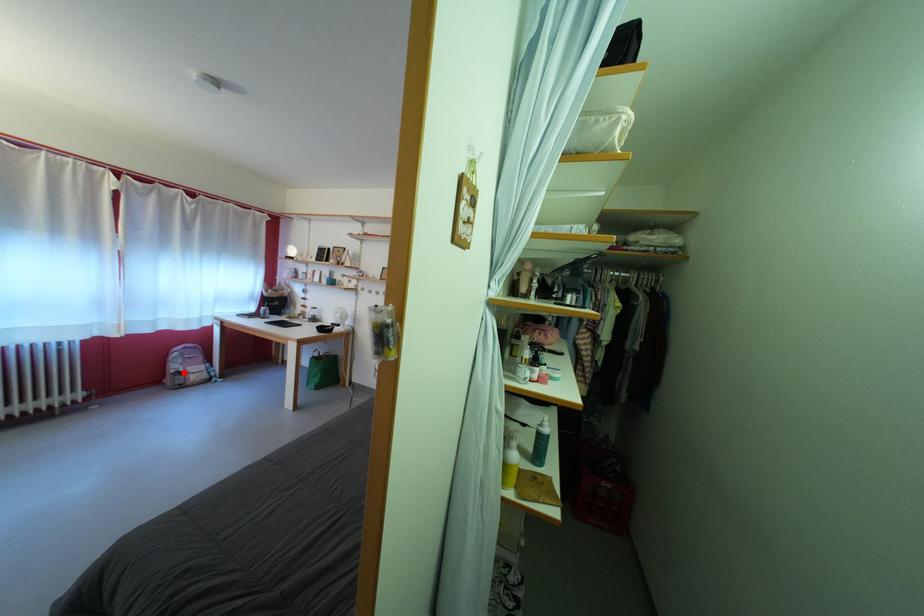
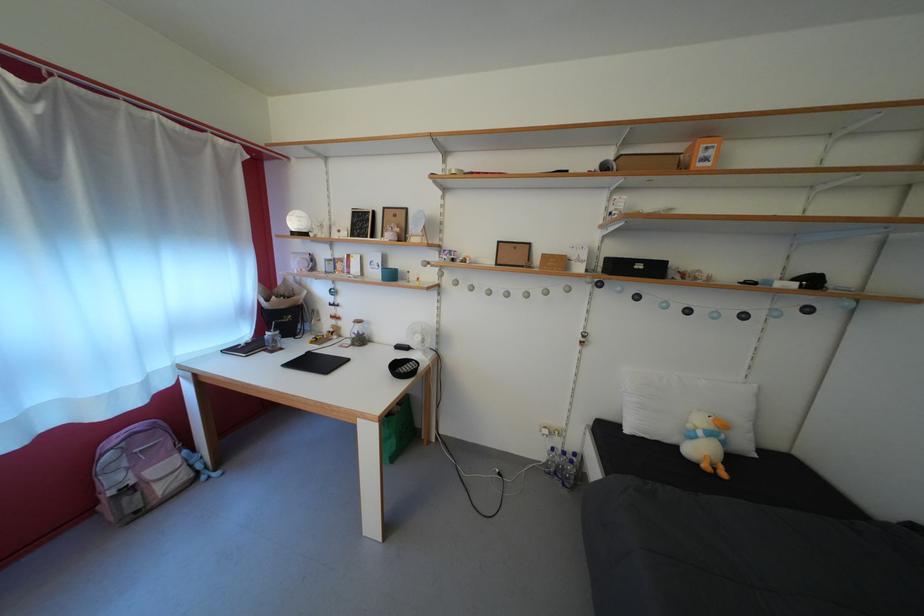
Locate, in the second image, the point that corresponds to the highlighted location in the first image.

(123, 485)